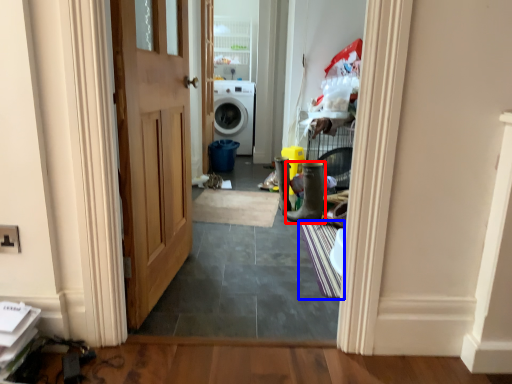
Question: Among these objects, which one is nearest to the camera, boot (highlighted by a red box) or doormat (highlighted by a blue box)?

Choices:
 (A) boot
 (B) doormat

Answer: (B)